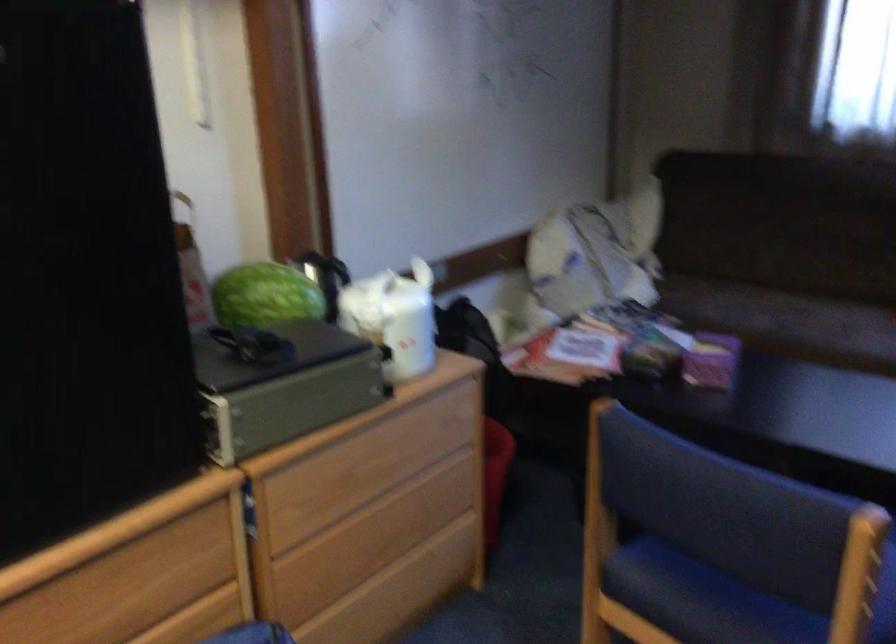
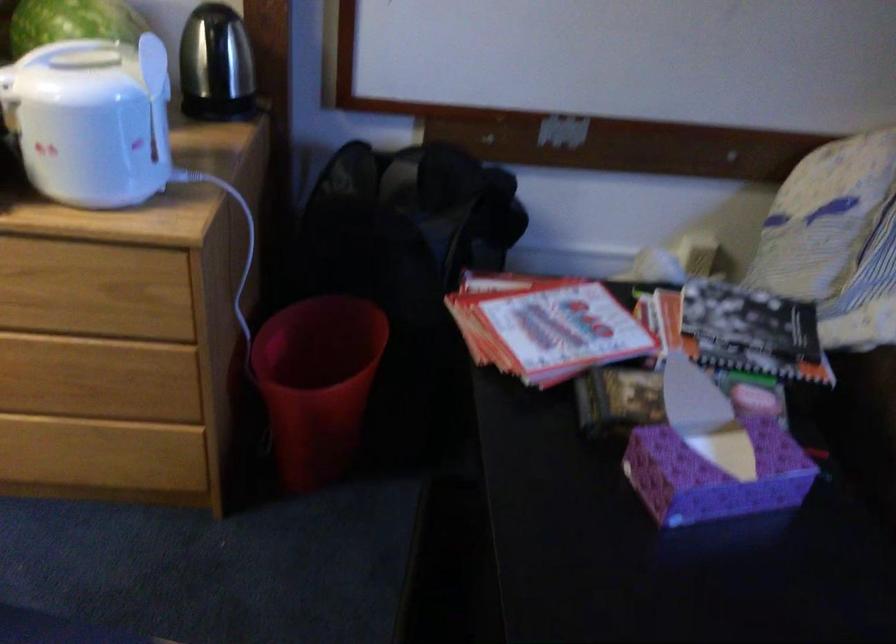
Locate, in the second image, the point that corresponds to (576,351) in the first image.

(545, 326)